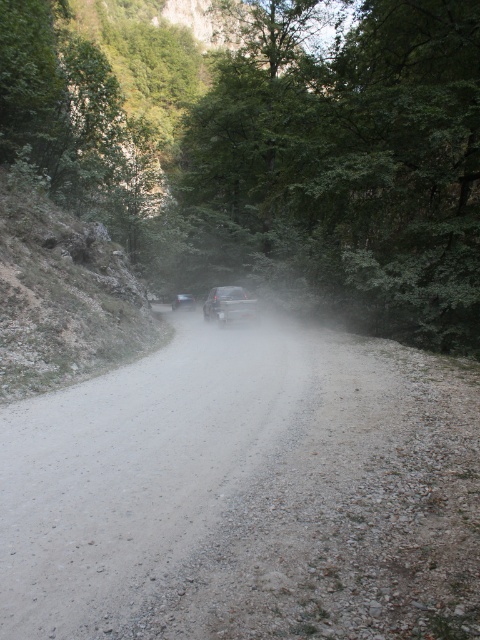
You are driving a metallic silver car at center on a narrow road through a forest. There is a green leafy tree at center blocking your path. Can you safely pass through without hitting the tree?

The green leafy tree at center is to the left of the metallic silver car at center, so you can safely navigate around it by moving to the right side of the road to avoid collision.

You are driving a metallic silver car at center and want to overtake the smokey gray car at center ahead of you on this narrow road. Is it safe to attempt passing given their positions?

The metallic silver car at center is closer to the viewer than the smokey gray car at center, meaning the smokey gray car is ahead on the road. Since the road is narrow and winding, overtaking might not be safe due to limited visibility and space. It is advisable to wait for a safer opportunity.

You are driving a metallic silver car at center and a smokey gray car at center. Which car is taller?

The metallic silver car at center is taller than the smokey gray car at center.